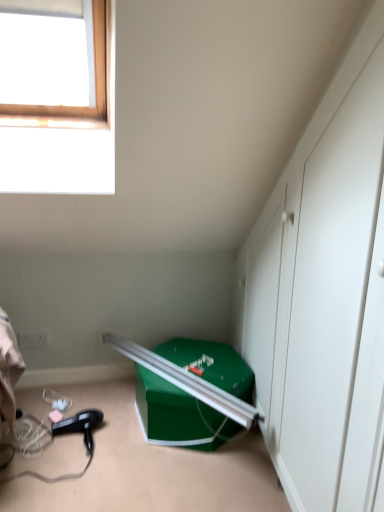
You are a GUI agent. You are given a task and a screenshot of the screen. Output one action in this format:
    pyautogui.click(x=<x>, y=<y>)
    Task: Click on the vacant space that's between green cardboard box at lower right and black plastic hair dryer at lower left
    The image size is (384, 512).
    Given the screenshot: What is the action you would take?
    pyautogui.click(x=119, y=421)